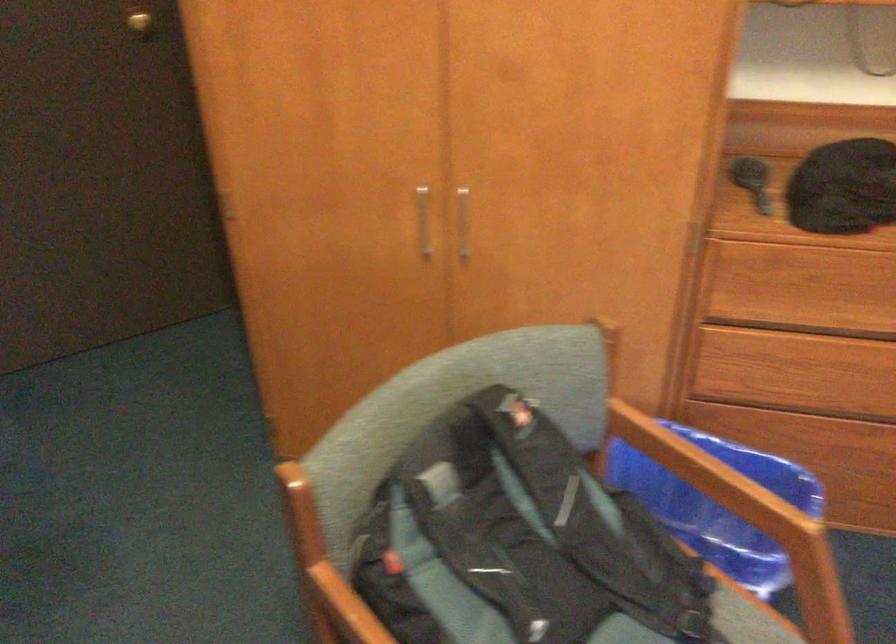
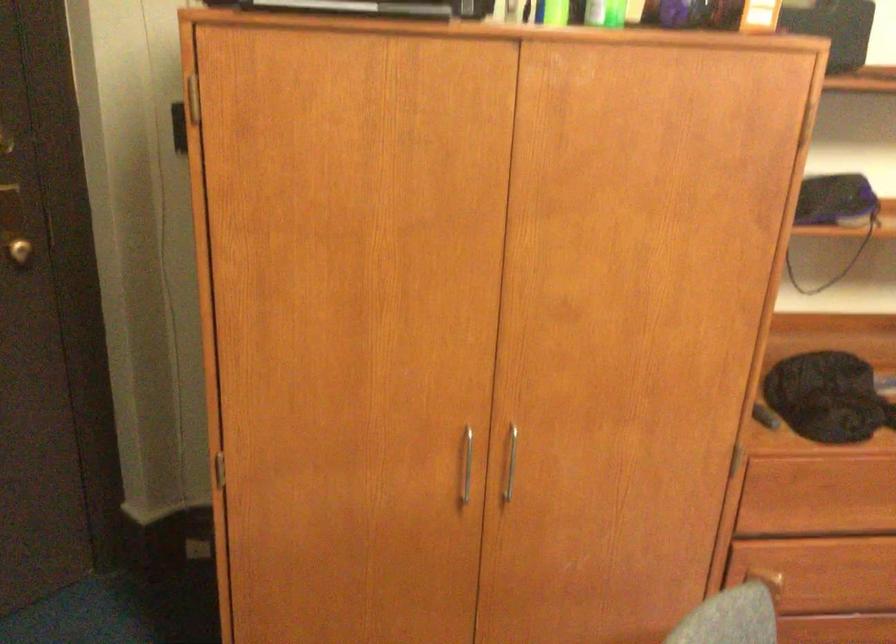
The point at (476, 216) is marked in the first image. Where is the corresponding point in the second image?

(511, 462)